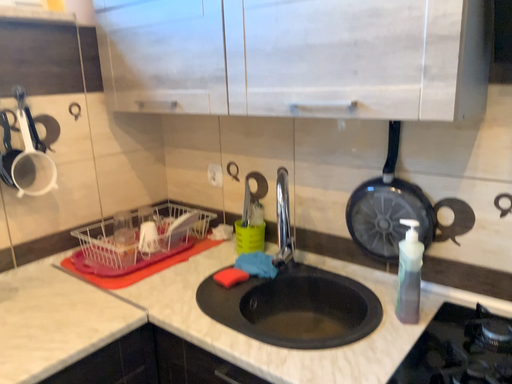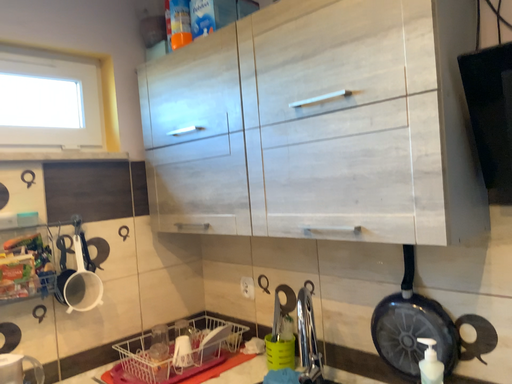
Question: Which way did the camera rotate in the video?

Choices:
 (A) rotated downward
 (B) rotated upward

Answer: (B)